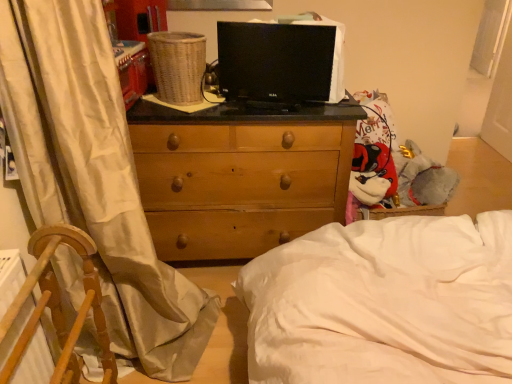
Question: Does point (189, 165) appear closer or farther from the camera than point (389, 173)?

Choices:
 (A) closer
 (B) farther

Answer: (A)

Question: Looking at their shapes, would you say wooden chest of drawers at center is wider or thinner than fluffy plush toy at right?

Choices:
 (A) thin
 (B) wide

Answer: (B)

Question: Which object is the closest to the fluffy plush toy at right?

Choices:
 (A) white fabric screen door at right
 (B) wooden chest of drawers at center
 (C) white silk curtain at left
 (D) black glossy tv at center
 (E) wooden chair at left

Answer: (B)

Question: Which object is the closest to the wooden chair at left?

Choices:
 (A) fluffy plush toy at right
 (B) wooden chest of drawers at center
 (C) woven brown basket at upper center
 (D) black glossy tv at center
 (E) white fabric screen door at right

Answer: (B)